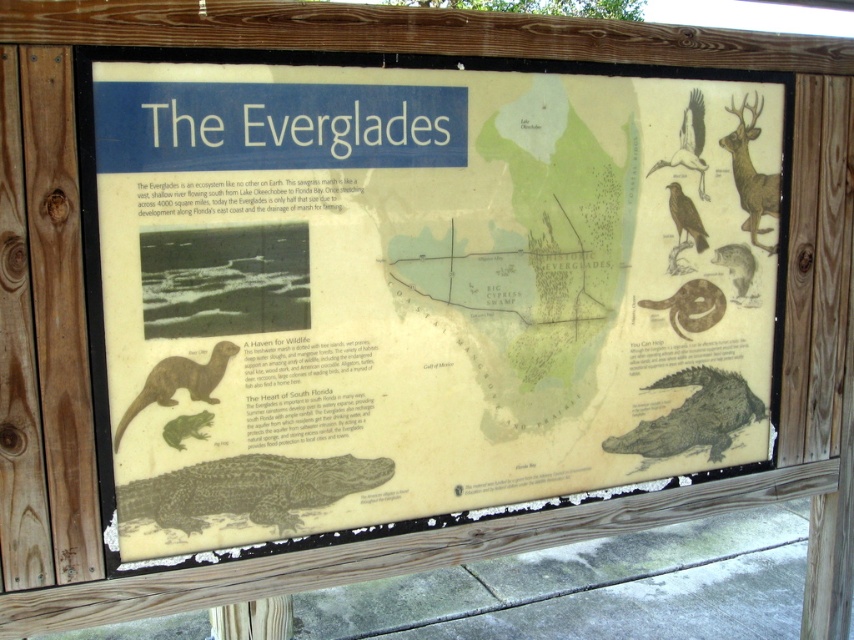
Question: Can you confirm if brown velvet deer at upper right is thinner than shiny metallic turtle at upper right?

Choices:
 (A) no
 (B) yes

Answer: (A)

Question: Which of the following is the closest to the observer?

Choices:
 (A) (153, 380)
 (B) (753, 266)
 (C) (173, 492)
 (D) (700, 392)

Answer: (A)

Question: Is brown feathered bird at upper right behind shiny metallic turtle at upper right?

Choices:
 (A) yes
 (B) no

Answer: (B)

Question: Can you confirm if brown velvet deer at upper right is thinner than brown feathered bird at upper right?

Choices:
 (A) no
 (B) yes

Answer: (A)

Question: Which of the following is the farthest from the observer?

Choices:
 (A) dark green scaly alligator at center
 (B) brown velvet deer at upper right

Answer: (B)

Question: Which point appears closest to the camera in this image?

Choices:
 (A) (316, 156)
 (B) (736, 273)
 (C) (764, 410)
 (D) (209, 376)

Answer: (D)